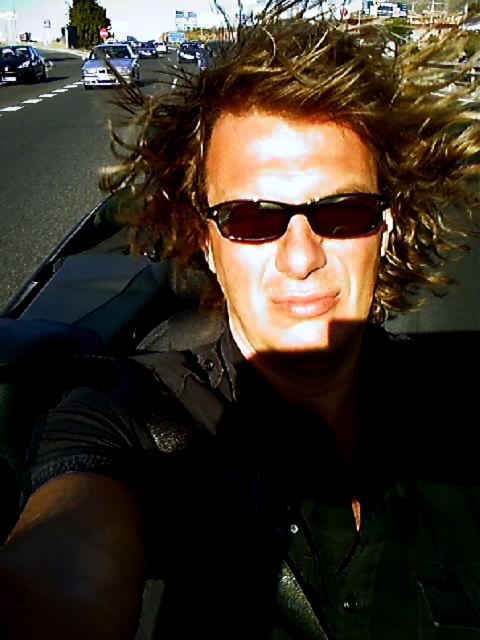
Question: Which of these objects is positioned closest to the shiny black sedan at left?

Choices:
 (A) sunglasses at center
 (B) shiny metallic sedan at center
 (C) shiny silver sedan at center

Answer: (C)

Question: Is shiny silver sedan at center positioned behind shiny metallic sedan at center?

Choices:
 (A) yes
 (B) no

Answer: (B)

Question: From the image, what is the correct spatial relationship of shiny black sedan at left in relation to shiny metallic sedan at center?

Choices:
 (A) left
 (B) right

Answer: (A)

Question: Is brown curly hair at center bigger than sunglasses at center?

Choices:
 (A) yes
 (B) no

Answer: (A)

Question: Among these objects, which one is nearest to the camera?

Choices:
 (A) shiny silver sedan at center
 (B) sunglasses at center

Answer: (B)

Question: Which of the following is the farthest from the observer?

Choices:
 (A) brown curly hair at center
 (B) sunglasses at center
 (C) shiny metallic sedan at center
 (D) shiny black sedan at left

Answer: (C)